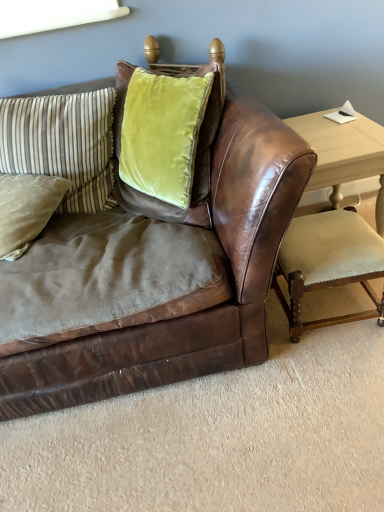
The width and height of the screenshot is (384, 512). I want to click on vacant space in velvet beige armchair at lower right (from a real-world perspective), so click(x=333, y=308).